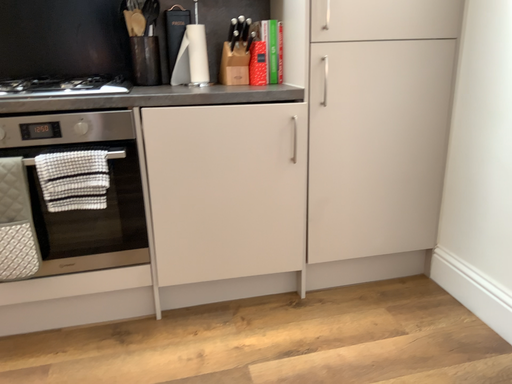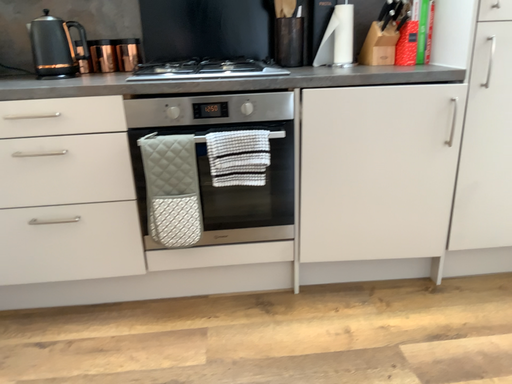
Question: How did the camera likely rotate when shooting the video?

Choices:
 (A) rotated left
 (B) rotated right

Answer: (A)